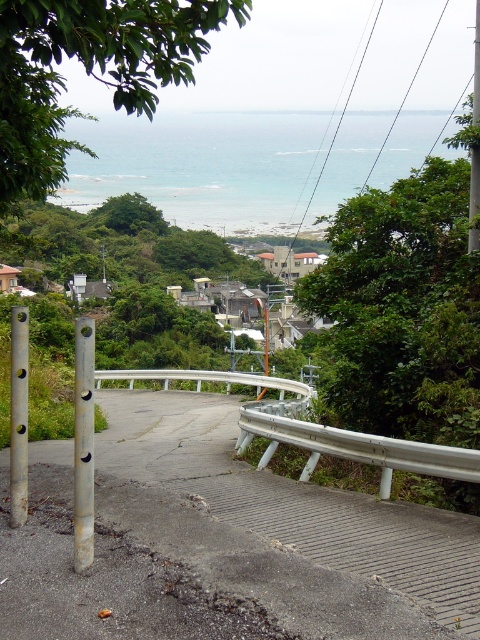
Question: From the image, what is the correct spatial relationship of silver metallic pole at left in relation to metallic pole at right?

Choices:
 (A) left
 (B) right

Answer: (A)

Question: Is silver metallic guardrail at lower right thinner than gold metallic pole at left?

Choices:
 (A) no
 (B) yes

Answer: (A)

Question: Which point is farther to the camera?

Choices:
 (A) silver metallic guardrail at lower right
 (B) metallic pole at right
 (C) gold metallic pole at left

Answer: (B)

Question: Can you confirm if silver metallic guardrail at lower right is smaller than gold metallic pole at left?

Choices:
 (A) no
 (B) yes

Answer: (A)

Question: Based on their relative distances, which object is farther from the gold metallic pole at left?

Choices:
 (A) silver metallic guardrail at lower right
 (B) silver metallic pole at left

Answer: (A)

Question: Which object appears closest to the camera in this image?

Choices:
 (A) silver metallic pole at left
 (B) metallic pole at right

Answer: (A)